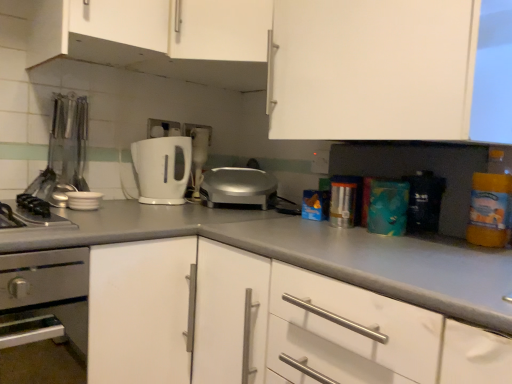
Find the location of a particular element. The image size is (512, 384). free space on the front side of teal matte box at center, the 3th appliance when ordered from left to right is located at coordinates (432, 241).